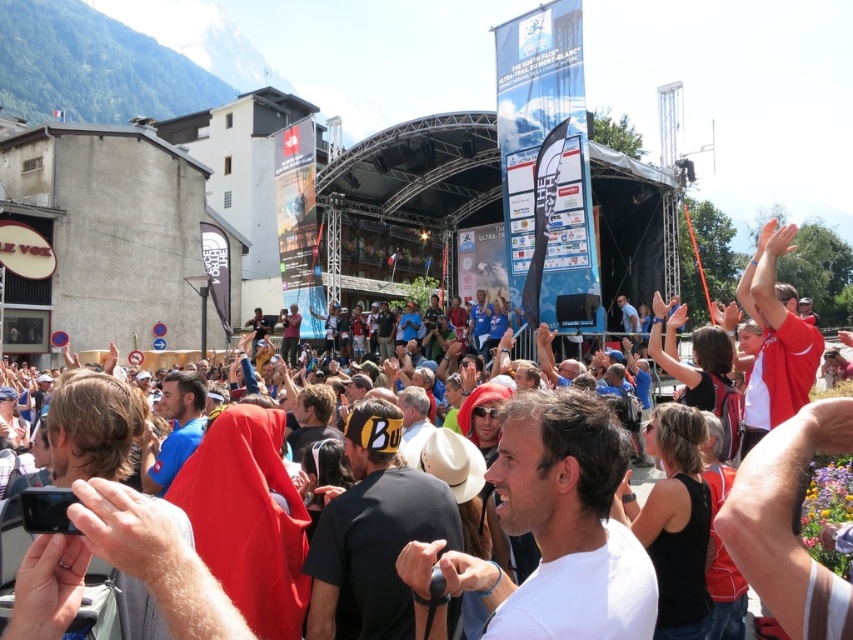
You are a photographer positioned at the camera location. You want to capture a closeup shot of the white matte shirt at center. Considering the distance, do you think you can achieve this without moving closer? Please explain.

The distance between the white matte shirt at center and the camera is 35.26 meters. To capture a closeup shot from this distance, you would need a telephoto lens with sufficient zoom capability. Without moving closer, it is possible if your equipment allows for such magnification.

You are standing at the center of the stage and want to move to the nearest point between point (502, 611) and point (201, 390). Which point should you go to?

You should go to point (502, 611) because it is closer to the viewer than point (201, 390).